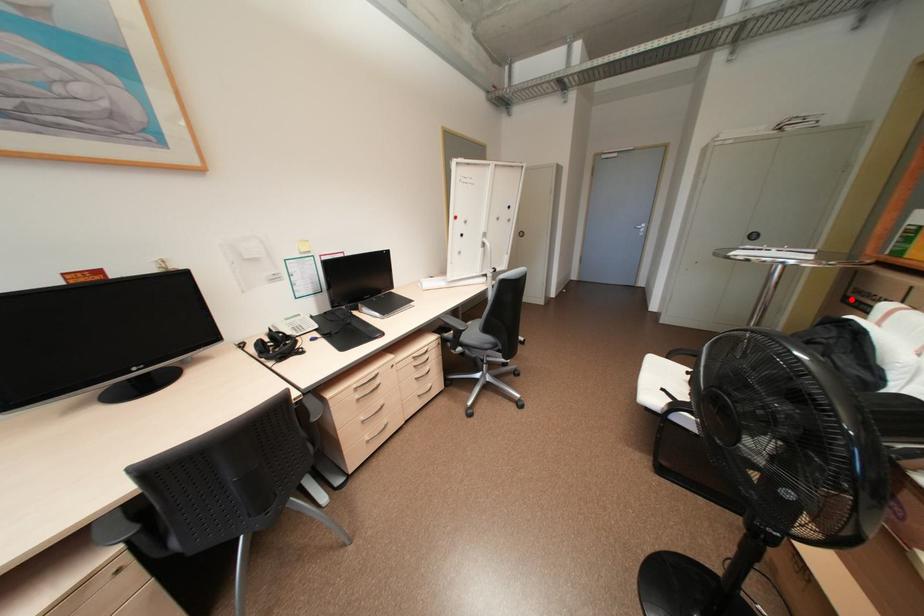
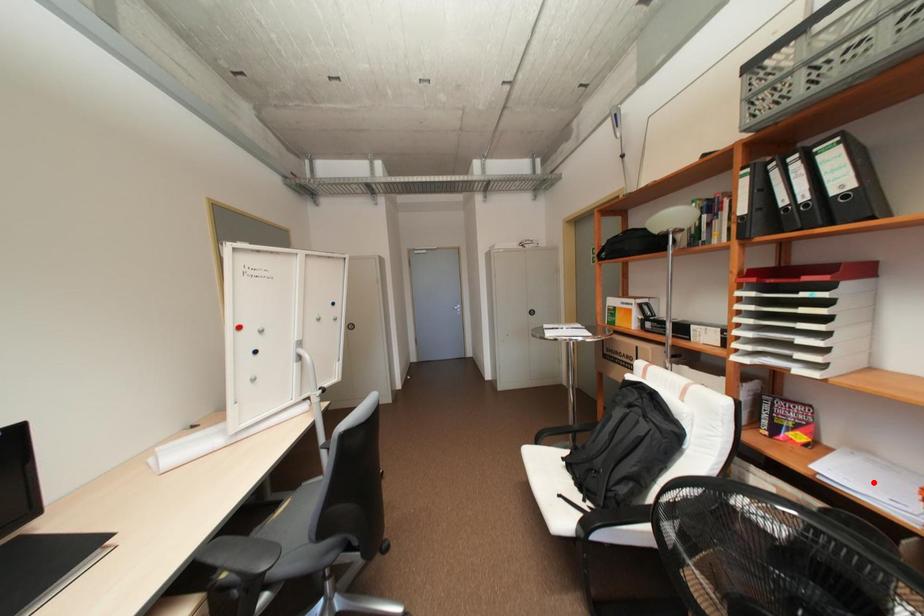
I am providing you with two images of the same scene from different viewpoints. A red point is marked on the first image and another point is marked on the second image. Do the highlighted points in image1 and image2 indicate the same real-world spot?

No